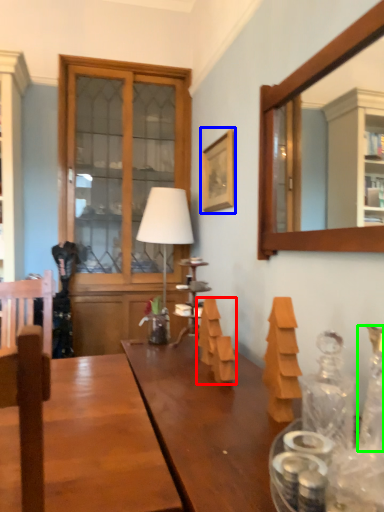
Question: Which object is the farthest from wood (highlighted by a red box)? Choose among these: picture frame (highlighted by a blue box) or bottle (highlighted by a green box).

Choices:
 (A) picture frame
 (B) bottle

Answer: (A)